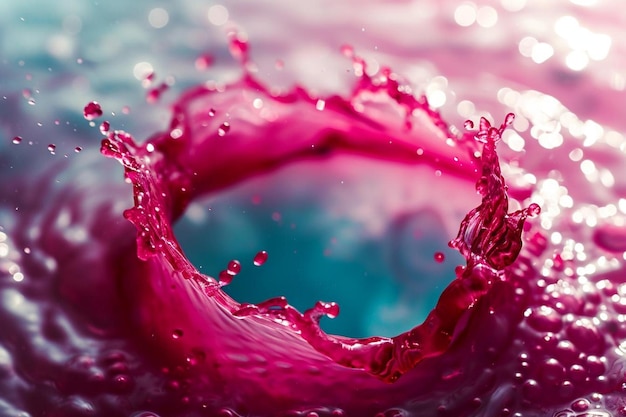
Identify the location of bright light. The height and width of the screenshot is (417, 626). click(586, 53), click(620, 59).